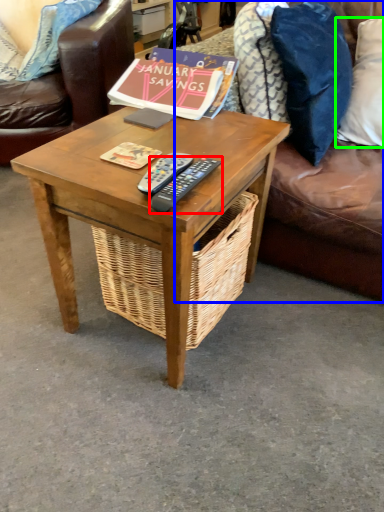
Question: Which is nearer to the remote control (highlighted by a red box)? studio couch (highlighted by a blue box) or pillow (highlighted by a green box).

Choices:
 (A) studio couch
 (B) pillow

Answer: (A)